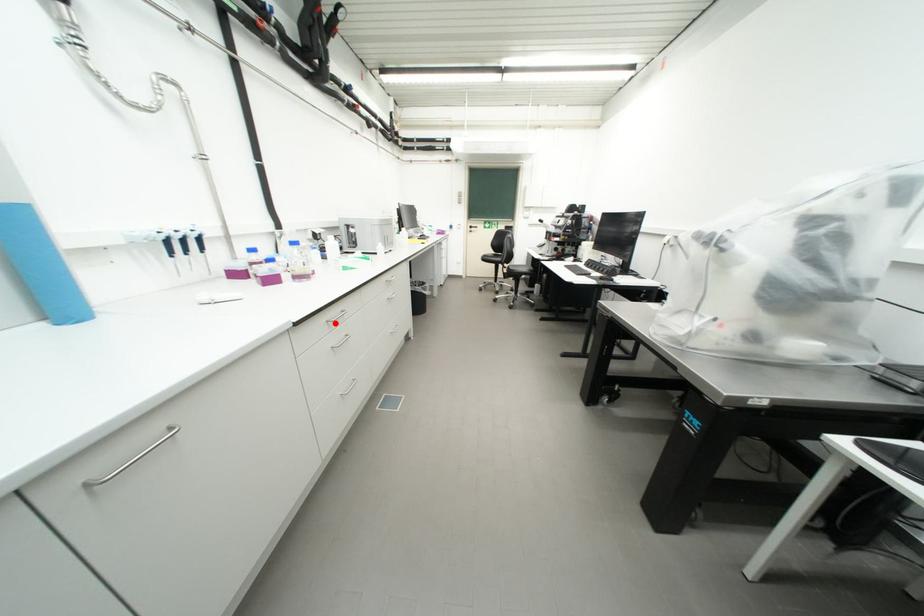
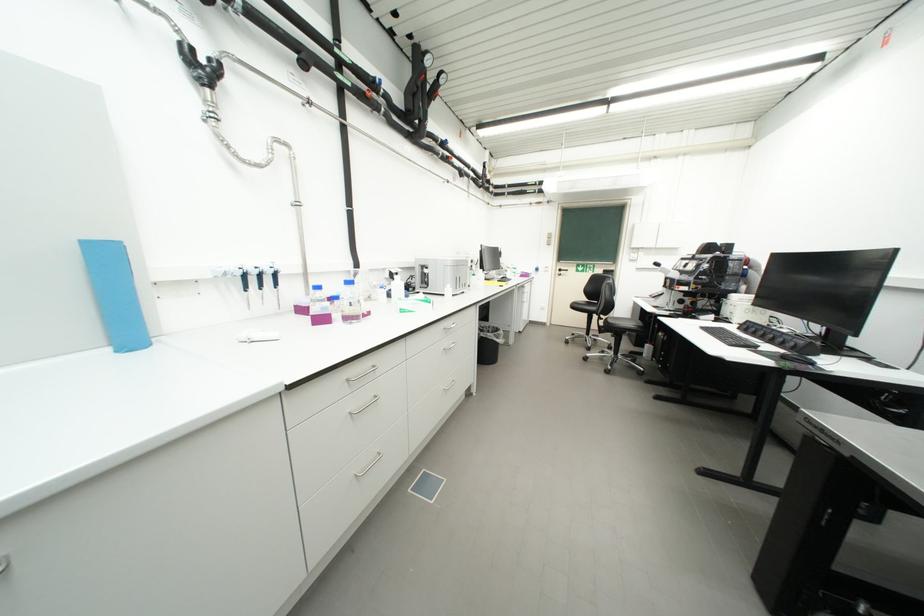
Where in the second image is the point corresponding to the highlighted location from the first image?

(356, 381)